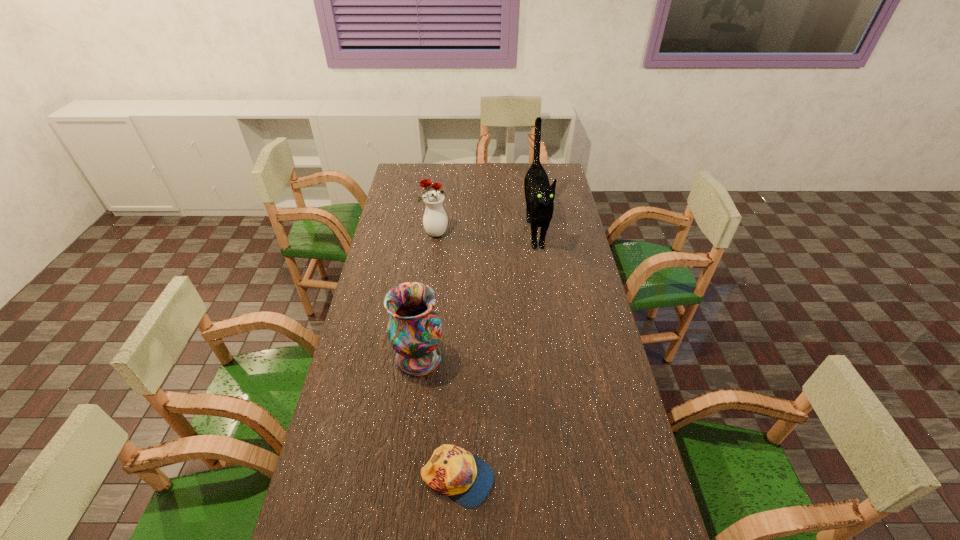
Where is `the tallest object`? The width and height of the screenshot is (960, 540). the tallest object is located at coordinates (539, 194).

The image size is (960, 540). I want to click on cat, so click(x=539, y=194).

You are a GUI agent. You are given a task and a screenshot of the screen. Output one action in this format:
    pyautogui.click(x=<x>, y=<y>)
    Task: Click on the farther vase
    
    Given the screenshot: What is the action you would take?
    pyautogui.click(x=435, y=221)

You are a GUI agent. You are given a task and a screenshot of the screen. Output one action in this format:
    pyautogui.click(x=<x>, y=<y>)
    Task: Click on the nearer vase
    This screenshot has height=540, width=960.
    Given the screenshot: What is the action you would take?
    pyautogui.click(x=414, y=330)

Identify the location of cap. (452, 471).

What are the coordinates of `the shortest object` in the screenshot? It's located at (452, 471).

The height and width of the screenshot is (540, 960). In order to click on free space located 0.370m on the face of the tallest object in this screenshot , I will do `click(550, 330)`.

The height and width of the screenshot is (540, 960). Identify the location of vacant position located on the right of the farther vase. (491, 234).

Locate an element on the screen. free region located 0.110m on the right of the second nearest object is located at coordinates (478, 358).

Find the location of `free space located on the bill of the cap`. free space located on the bill of the cap is located at coordinates (566, 479).